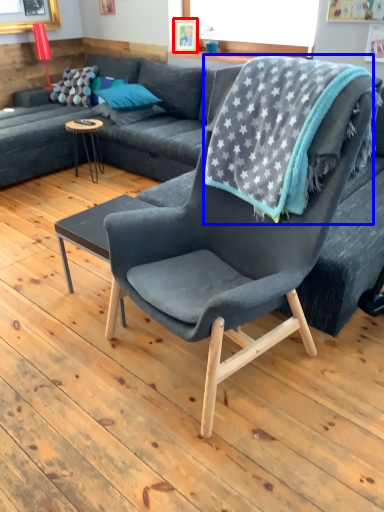
Question: Among these objects, which one is farthest to the camera, picture frame (highlighted by a red box) or blanket (highlighted by a blue box)?

Choices:
 (A) picture frame
 (B) blanket

Answer: (A)